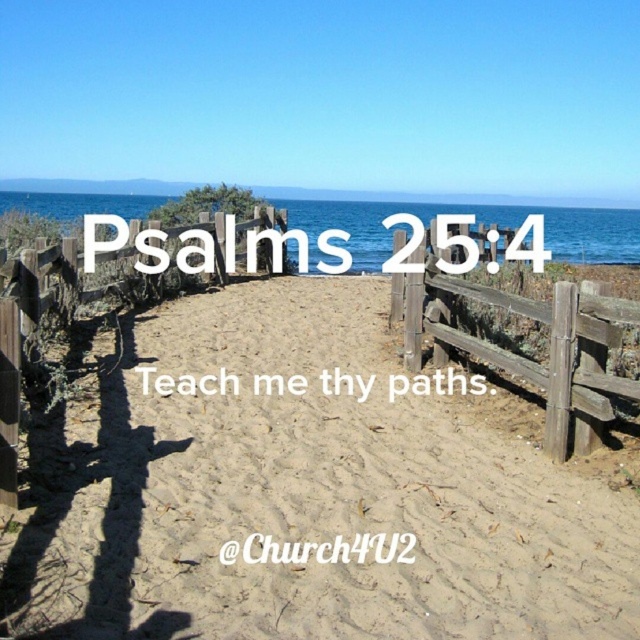
You are standing at the wooden fence and want to walk to the ocean. There are two points marked on the path. Which point is closer to your current position at the fence? The points are point (410, 289) and point (6, 291).

Point (6, 291) is closer to the wooden fence because it is positioned lower on the path, which is closer to the foreground where you are standing.

You are a hiker walking along the sandy path and notice two fences ahead. Which one is closer to you, the weathered wood fence at center or the wooden fence at center?

The weathered wood fence at center is positioned under the wooden fence at center, meaning the wooden fence at center is closer to you.

You are standing on the wooden fence at center and want to walk towards the ocean. Which direction should you move to reach the brown sandy path at center?

The brown sandy path at center is to the right of the wooden fence at center, so you should move to the right to reach it.